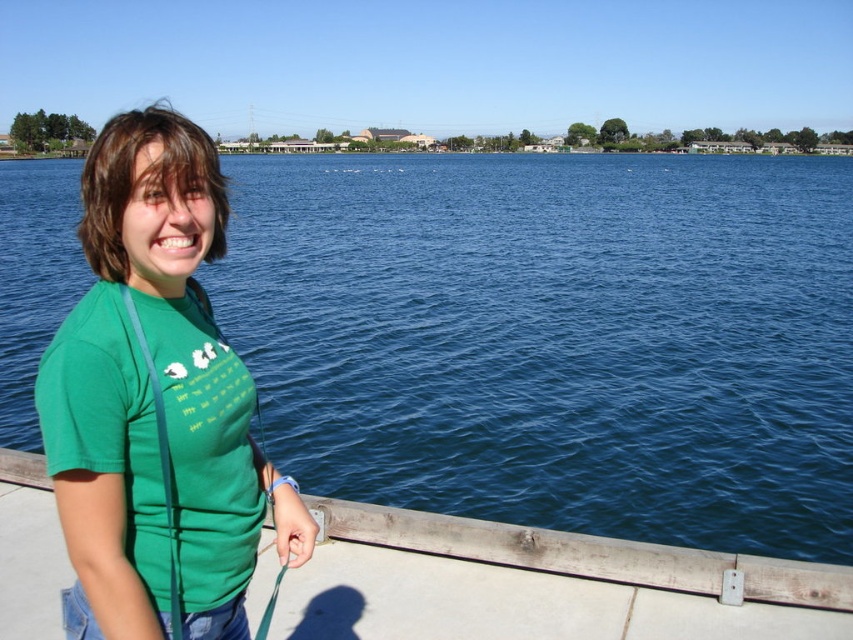
You are a photographer trying to capture the reflection of the blue water at center in your shot. The green matte shirt at left is blocking part of the view. Can you adjust your position to include both the reflection and the shirt without moving either object?

The green matte shirt at left is behind blue water at center, so you can move your position slightly to the side to include both the reflection of the blue water at center and the green matte shirt at left in your shot since the shirt is not in front of the water.

You are an observer looking at the scene. Which object, the blue water at center or the green matte shirt at left, occupies a larger vertical space in the image?

The blue water at center has a greater height compared to the green matte shirt at left, so it occupies a larger vertical space in the image.